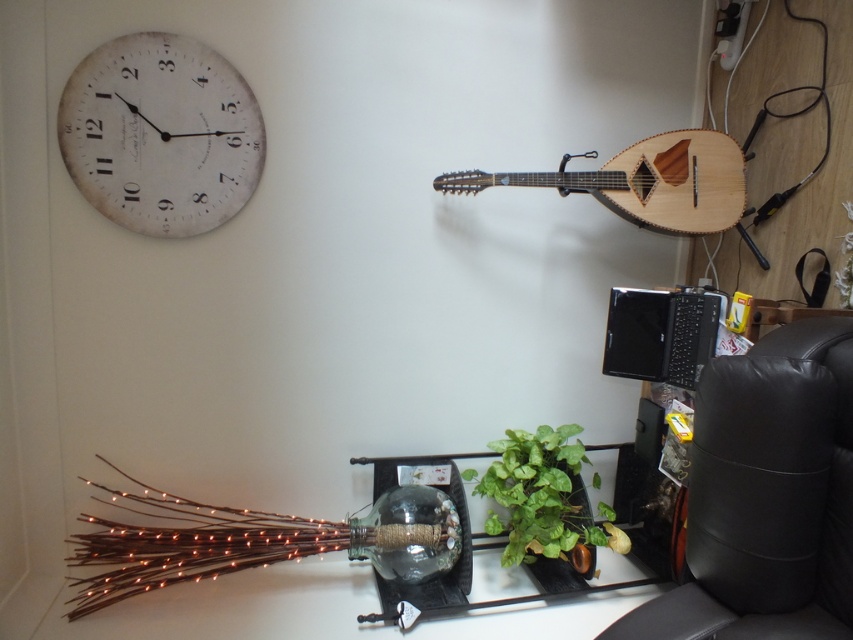
You are standing in the corner of the room and see two points marked on the wall. The first point is at coordinates point (x=741, y=589) and the second point is at point (x=550, y=465). Which point is closer to you?

Point (x=741, y=589) is in front of point (x=550, y=465), so it is closer to you.

You are standing in the room depicted in the scene. There is a point marked at coordinates (766, 497). What object is located at that point?

The point at coordinates (766, 497) indicates the location of the black leather armchair at right.

From the picture: You are standing in the room and want to reach the glass located at point (253, 534). If your arm can extend 2.5 feet, can you reach it without moving?

The distance between you and the glass at point (253, 534) is 7.05 feet, which is greater than your arm extension of 2.5 feet. Therefore, you cannot reach it without moving.